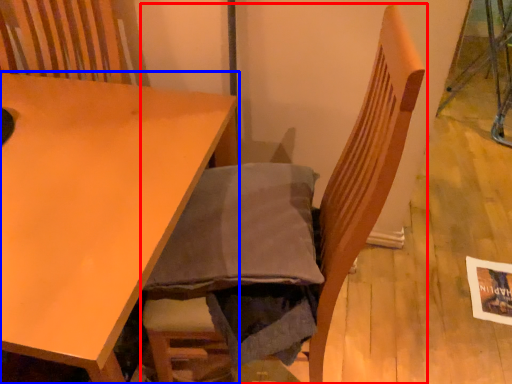
Question: Among these objects, which one is farthest to the camera, chair (highlighted by a red box) or table (highlighted by a blue box)?

Choices:
 (A) chair
 (B) table

Answer: (B)